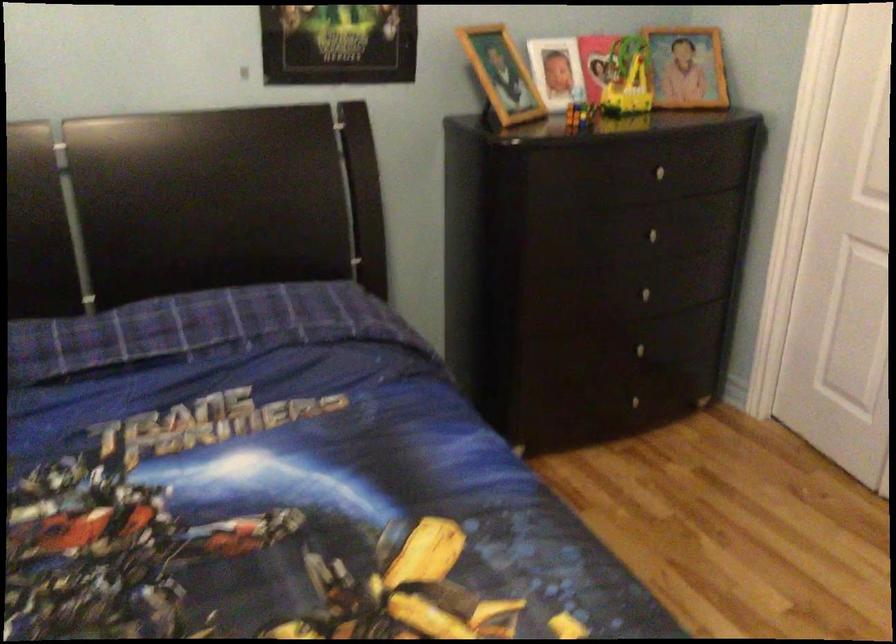
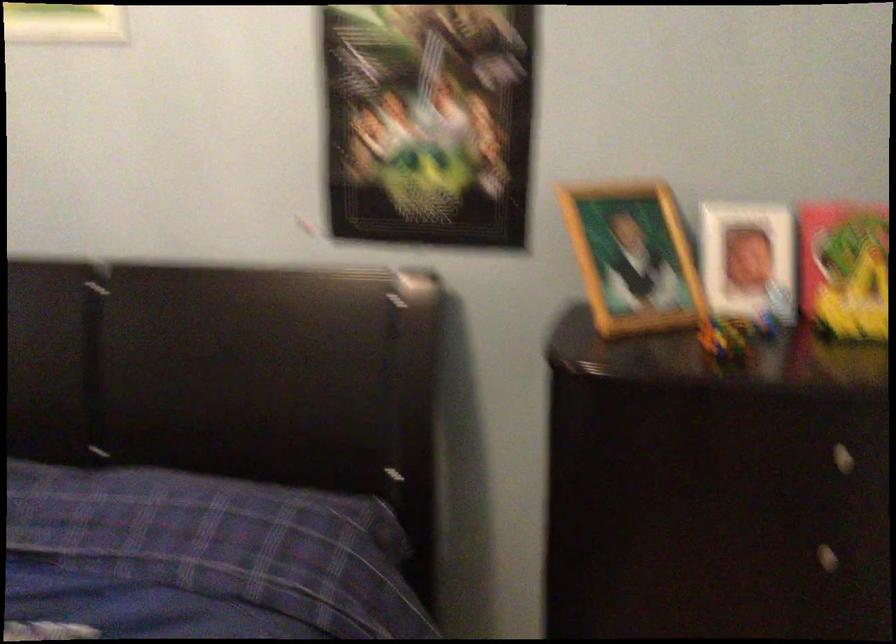
Where in the second image is the point corresponding to the point at 644,239 from the first image?

(807, 554)